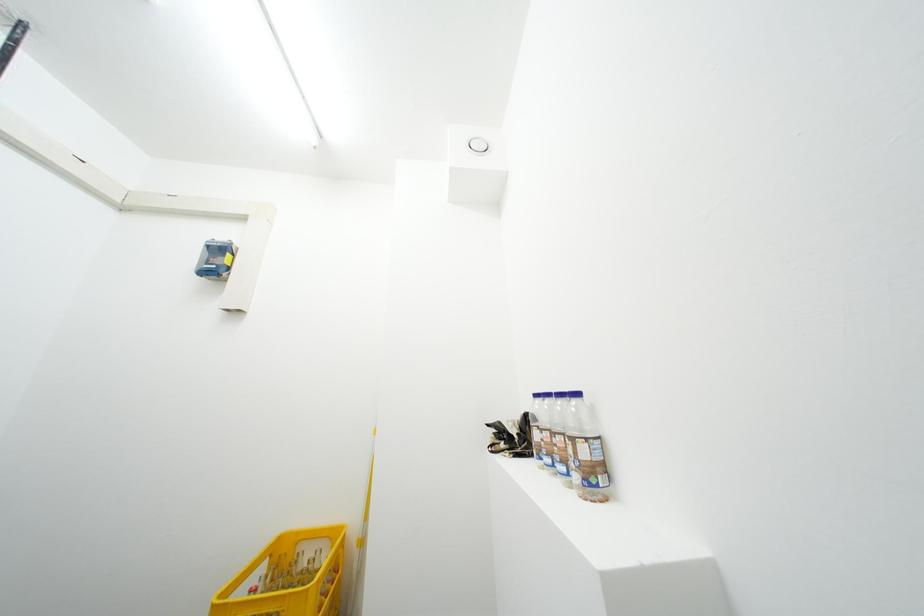
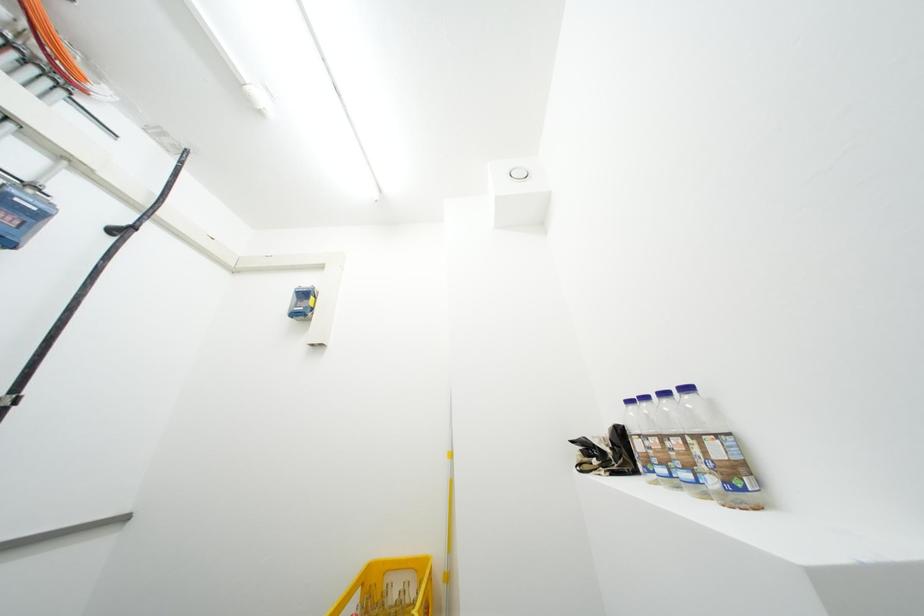
Question: Which direction would the cameraman need to move to produce the second image? Reply with the corresponding letter.

Choices:
 (A) Left
 (B) Right
 (C) Forward
 (D) Backward

Answer: (A)